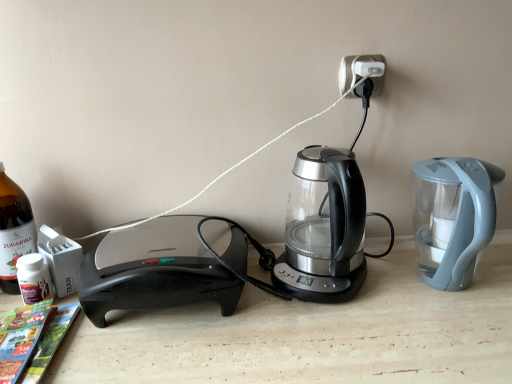
Question: Should I look upward or downward to see matte paper magazine at lower left?

Choices:
 (A) up
 (B) down

Answer: (B)

Question: Does white plastic electric outlet at upper center have a lesser width compared to matte paper magazine at lower left?

Choices:
 (A) yes
 (B) no

Answer: (A)

Question: Can you confirm if white plastic electric outlet at upper center is positioned to the left of matte paper magazine at lower left?

Choices:
 (A) yes
 (B) no

Answer: (B)

Question: Considering the relative positions of white plastic electric outlet at upper center and matte paper magazine at lower left in the image provided, is white plastic electric outlet at upper center behind matte paper magazine at lower left?

Choices:
 (A) no
 (B) yes

Answer: (B)

Question: Is white plastic electric outlet at upper center turned away from matte paper magazine at lower left?

Choices:
 (A) no
 (B) yes

Answer: (A)

Question: From a real-world perspective, is white plastic electric outlet at upper center on matte paper magazine at lower left?

Choices:
 (A) no
 (B) yes

Answer: (B)

Question: Is white plastic electric outlet at upper center surrounding matte paper magazine at lower left?

Choices:
 (A) no
 (B) yes

Answer: (A)

Question: From the image's perspective, would you say matte paper magazine at lower left is shown under transparent glass kettle at center?

Choices:
 (A) yes
 (B) no

Answer: (A)

Question: Does matte paper magazine at lower left touch transparent glass kettle at center?

Choices:
 (A) no
 (B) yes

Answer: (A)

Question: From the image's perspective, is matte paper magazine at lower left located above transparent glass kettle at center?

Choices:
 (A) no
 (B) yes

Answer: (A)

Question: Is matte paper magazine at lower left far from transparent glass kettle at center?

Choices:
 (A) yes
 (B) no

Answer: (B)

Question: Is matte paper magazine at lower left closer to the viewer compared to transparent glass kettle at center?

Choices:
 (A) yes
 (B) no

Answer: (A)

Question: From a real-world perspective, is matte paper magazine at lower left positioned under transparent glass kettle at center based on gravity?

Choices:
 (A) no
 (B) yes

Answer: (B)

Question: Is the position of white plastic electric outlet at upper center more distant than that of bottle glass at left?

Choices:
 (A) no
 (B) yes

Answer: (B)